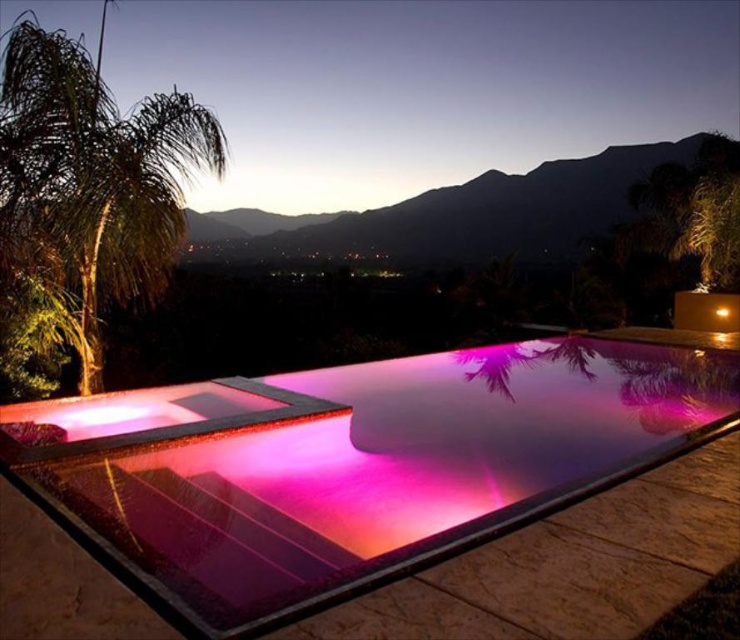
You are a landscape photographer planning to capture the purple glass pool at center and the green leafy palm tree at left in a single shot. Based on their sizes in the image, which object should you focus on first to ensure both are in frame?

The purple glass pool at center is smaller than the green leafy palm tree at left, so you should focus on the green leafy palm tree at left first to ensure both are in frame.

You are planning to place a 10 feet long bench between the purple glass pool at center and the green leafy palm tree at left. Will the bench fit perfectly between them without overlapping either object?

The distance between the purple glass pool at center and the green leafy palm tree at left is 10.41 feet. Since the bench is 10 feet long, there will be enough space for it to fit between them with a small gap remaining.